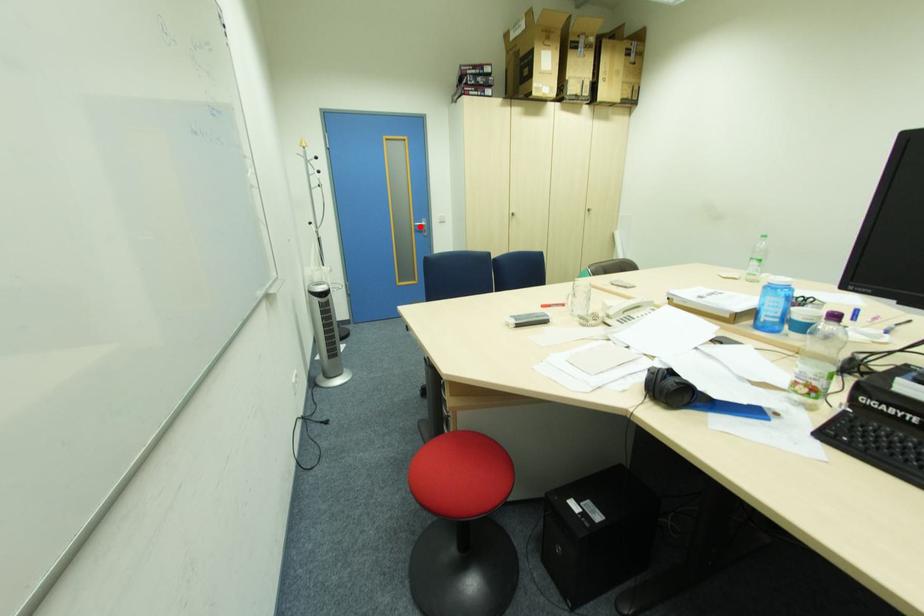
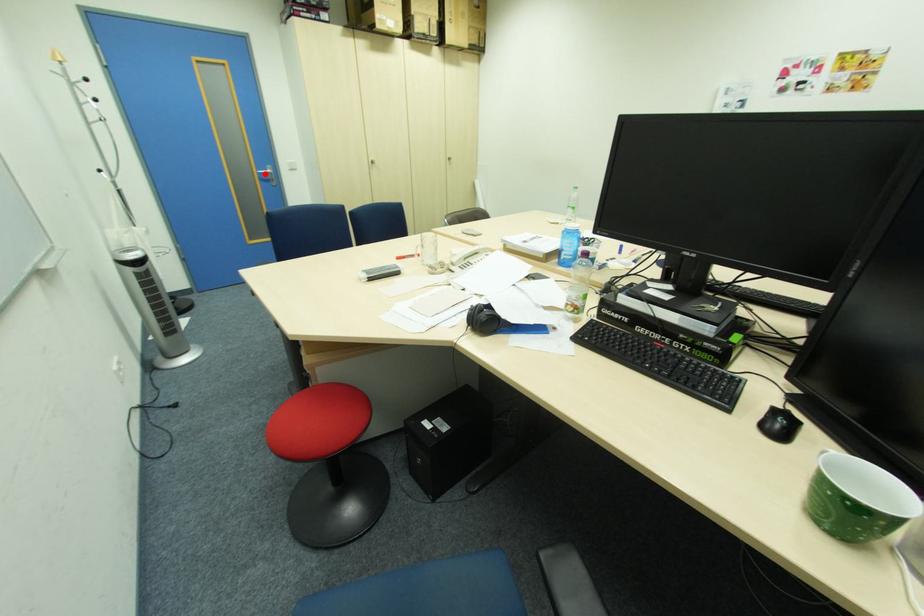
I am providing you with two images of the same scene from different viewpoints. A red point is marked on the first image and another point is marked on the second image. Are the points marked in image1 and image2 representing the same 3D position?

Yes